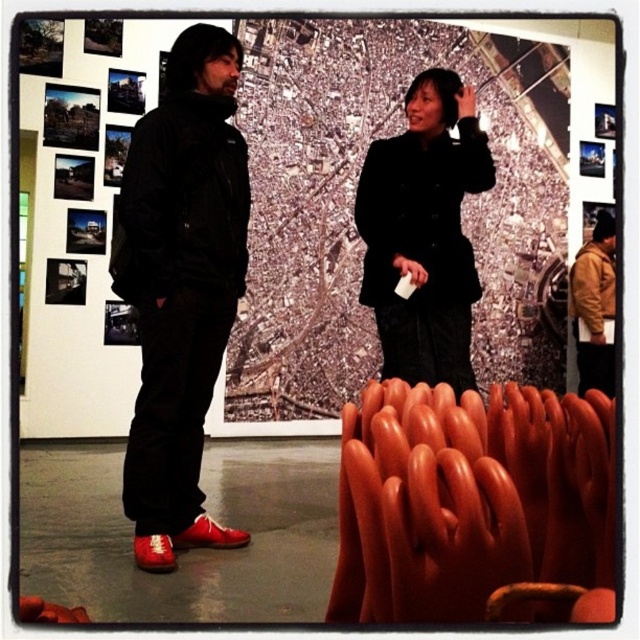
Question: Estimate the real-world distances between objects in this image. Which object is farther from the matte black jacket at left?

Choices:
 (A) shiny red shoe at lower left
 (B) matte black coat at center
 (C) brown leather jacket at right

Answer: (C)

Question: Among these points, which one is nearest to the camera?

Choices:
 (A) (225, 541)
 (B) (576, 420)
 (C) (168, 566)

Answer: (B)

Question: Considering the relative positions of brown leather jacket at right and red leather shoe at lower left in the image provided, where is brown leather jacket at right located with respect to red leather shoe at lower left?

Choices:
 (A) right
 (B) left

Answer: (A)

Question: Which of the following is the farthest from the observer?

Choices:
 (A) brown leather jacket at right
 (B) matte black jacket at left

Answer: (A)

Question: In this image, where is rubber-like orange chair at lower right located relative to matte black jacket at left?

Choices:
 (A) below
 (B) above

Answer: (A)

Question: Is matte black jacket at left to the left of matte black coat at center from the viewer's perspective?

Choices:
 (A) no
 (B) yes

Answer: (B)